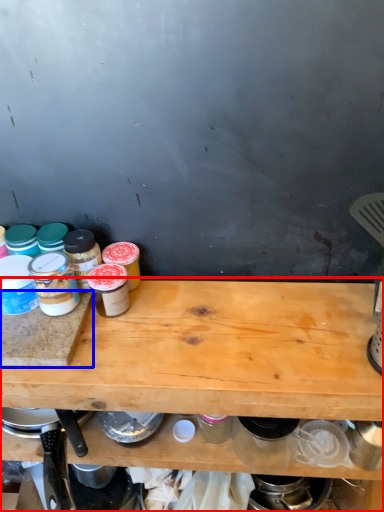
Question: Which object is further to the camera taking this photo, table (highlighted by a red box) or cutting board (highlighted by a blue box)?

Choices:
 (A) table
 (B) cutting board

Answer: (B)